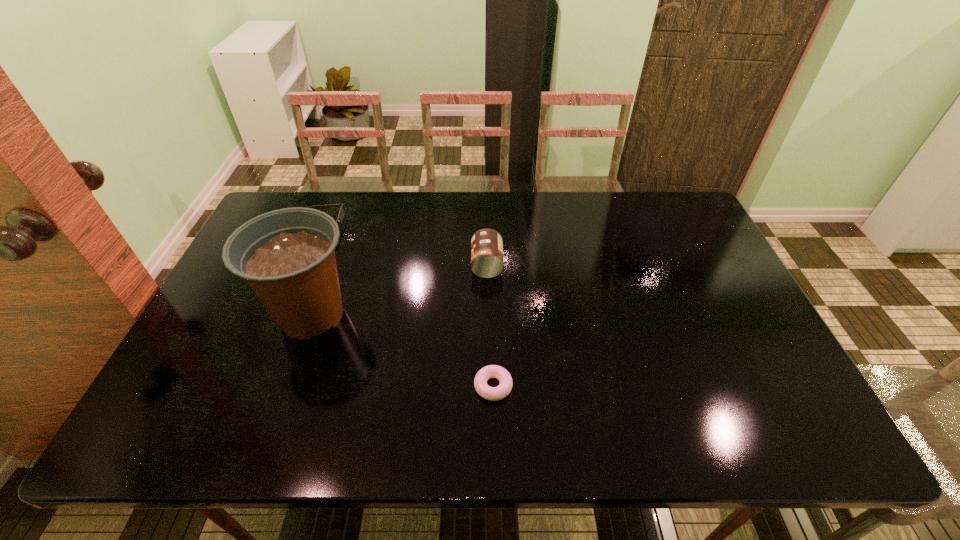
At what (x,y) coordinates should I click in order to perform the action: click on flowerpot. Please return your answer as a coordinate pair (x, y). Looking at the image, I should click on 287,256.

You are a GUI agent. You are given a task and a screenshot of the screen. Output one action in this format:
    pyautogui.click(x=<x>, y=<y>)
    Task: Click on the third farthest object
    The width and height of the screenshot is (960, 540).
    Given the screenshot: What is the action you would take?
    pyautogui.click(x=287, y=256)

Find the location of `the second farthest object`. the second farthest object is located at coordinates (487, 261).

Where is `can`? Image resolution: width=960 pixels, height=540 pixels. can is located at coordinates (487, 261).

Find the location of `spectacles`. spectacles is located at coordinates (341, 212).

You are a GUI agent. You are given a task and a screenshot of the screen. Output one action in this format:
    pyautogui.click(x=<x>, y=<y>)
    Task: Click on the second shortest object
    
    Given the screenshot: What is the action you would take?
    pyautogui.click(x=341, y=212)

I want to click on the shortest object, so click(491, 371).

The height and width of the screenshot is (540, 960). I want to click on doughnut, so click(x=491, y=371).

Locate an element on the screen. vacant space situated on the front of the flowerpot is located at coordinates (288, 382).

Locate an element on the screen. free space located on the front label of the third nearest object is located at coordinates (401, 264).